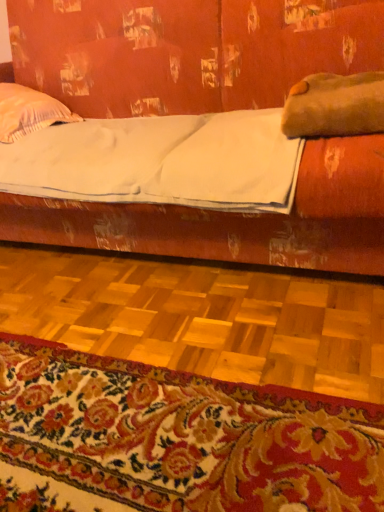
Question: Considering the relative sizes of floral carpet at lower center and brown fuzzy pillow at upper right, acting as the 2th pillow starting from the left, in the image provided, is floral carpet at lower center thinner than brown fuzzy pillow at upper right, acting as the 2th pillow starting from the left,?

Choices:
 (A) yes
 (B) no

Answer: (A)

Question: Is floral carpet at lower center facing away from brown fuzzy pillow at upper right, the first pillow positioned from the front?

Choices:
 (A) yes
 (B) no

Answer: (B)

Question: Is floral carpet at lower center positioned beyond the bounds of brown fuzzy pillow at upper right, the first pillow positioned from the front?

Choices:
 (A) yes
 (B) no

Answer: (A)

Question: From a real-world perspective, is floral carpet at lower center located higher than brown fuzzy pillow at upper right, placed as the second pillow when sorted from back to front?

Choices:
 (A) no
 (B) yes

Answer: (A)

Question: Does floral carpet at lower center have a larger size compared to brown fuzzy pillow at upper right, acting as the 2th pillow starting from the left?

Choices:
 (A) yes
 (B) no

Answer: (A)

Question: Considering the relative positions of floral carpet at lower center and brown fuzzy pillow at upper right, the first pillow positioned from the front, in the image provided, is floral carpet at lower center to the right of brown fuzzy pillow at upper right, the first pillow positioned from the front, from the viewer's perspective?

Choices:
 (A) yes
 (B) no

Answer: (B)

Question: Is matte wood studio couch at upper center smaller than floral carpet at lower center?

Choices:
 (A) yes
 (B) no

Answer: (B)

Question: From a real-world perspective, does matte wood studio couch at upper center sit lower than floral carpet at lower center?

Choices:
 (A) yes
 (B) no

Answer: (B)

Question: From the image's perspective, is matte wood studio couch at upper center above floral carpet at lower center?

Choices:
 (A) yes
 (B) no

Answer: (A)

Question: From the image's perspective, is matte wood studio couch at upper center located beneath floral carpet at lower center?

Choices:
 (A) yes
 (B) no

Answer: (B)

Question: Considering the relative positions of matte wood studio couch at upper center and floral carpet at lower center in the image provided, is matte wood studio couch at upper center in front of floral carpet at lower center?

Choices:
 (A) no
 (B) yes

Answer: (A)

Question: Are matte wood studio couch at upper center and floral carpet at lower center located far from each other?

Choices:
 (A) yes
 (B) no

Answer: (A)

Question: Considering the relative sizes of white striped pillow at upper left, the first pillow when ordered from left to right, and matte wood studio couch at upper center in the image provided, is white striped pillow at upper left, the first pillow when ordered from left to right, taller than matte wood studio couch at upper center?

Choices:
 (A) no
 (B) yes

Answer: (A)